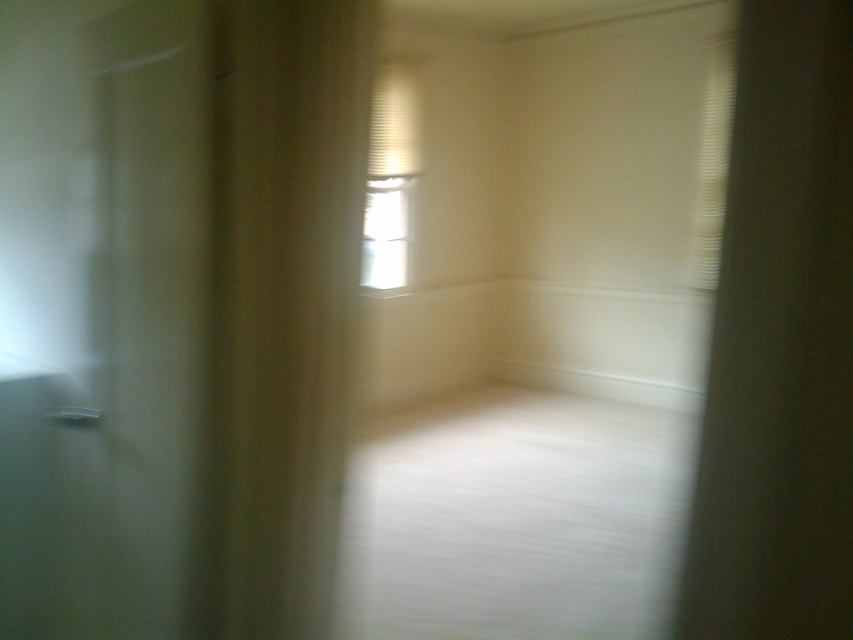
Can you confirm if beige fabric curtain at left is smaller than transparent glass window at center?

Actually, beige fabric curtain at left might be larger than transparent glass window at center.

The width and height of the screenshot is (853, 640). What do you see at coordinates (283, 305) in the screenshot?
I see `beige fabric curtain at left` at bounding box center [283, 305].

Does point (242, 476) lie in front of point (379, 282)?

Yes.

Identify the location of beige fabric curtain at left. (283, 305).